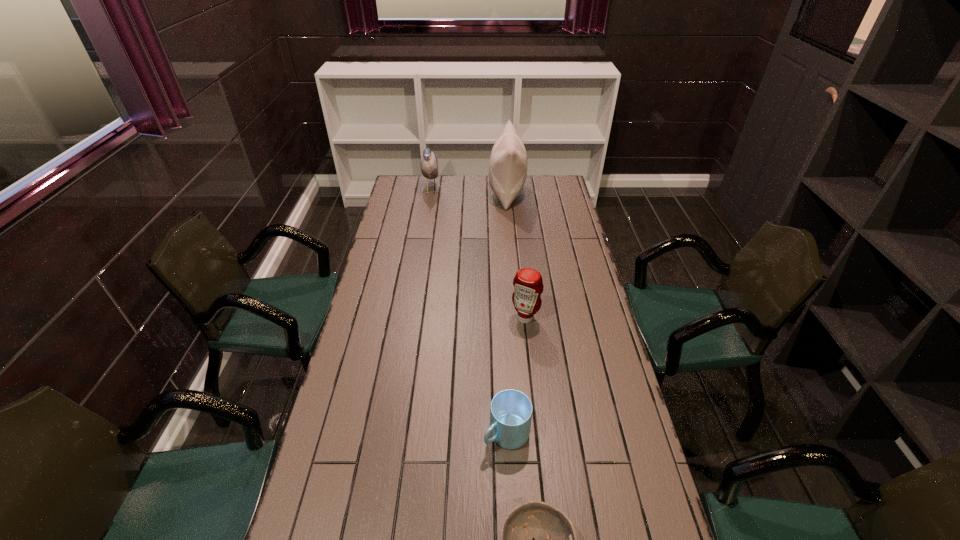
I want to click on the tallest object, so click(x=508, y=162).

Find the location of a particular element. This screenshot has width=960, height=540. the leftmost object is located at coordinates (429, 165).

Locate an element on the screen. the third shortest object is located at coordinates (528, 285).

Locate an element on the screen. This screenshot has width=960, height=540. the third nearest object is located at coordinates (528, 285).

I want to click on mug, so click(x=511, y=411).

Locate an element on the screen. The height and width of the screenshot is (540, 960). the fourth farthest object is located at coordinates (511, 411).

Where is `vacant space situated on the front side of the cushion`? vacant space situated on the front side of the cushion is located at coordinates (453, 193).

Find the location of a particular element. free space located on the front side of the cushion is located at coordinates (455, 193).

Locate an element on the screen. Image resolution: width=960 pixels, height=540 pixels. vacant space located on the front side of the cushion is located at coordinates (421, 193).

Identify the location of vacant space situated at the tip of the bird's beak. (488, 190).